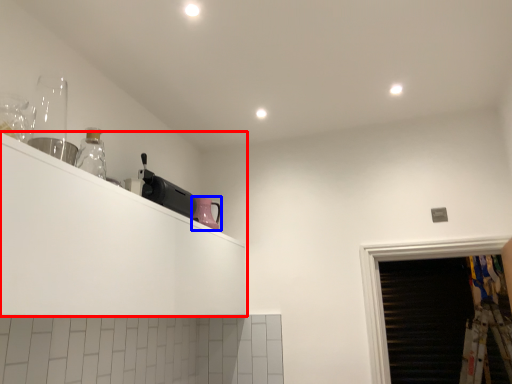
Question: Among these objects, which one is farthest to the camera, shelf (highlighted by a red box) or appliance (highlighted by a blue box)?

Choices:
 (A) shelf
 (B) appliance

Answer: (B)